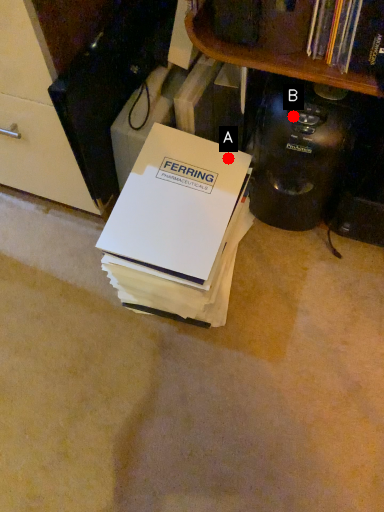
Question: Two points are circled on the image, labeled by A and B beside each circle. Which point appears farthest from the camera in this image?

Choices:
 (A) A is further
 (B) B is further

Answer: (A)